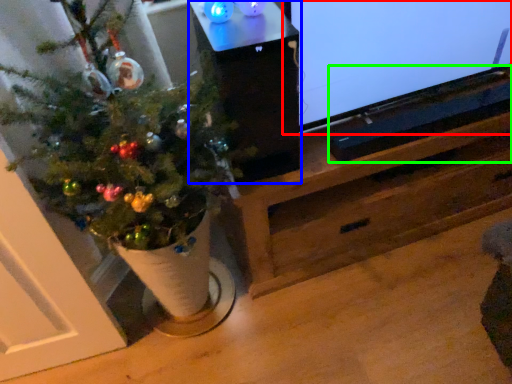
Question: Which object is positioned closest to television (highlighted by a red box)? Select from table (highlighted by a blue box) and wide (highlighted by a green box).

Choices:
 (A) table
 (B) wide

Answer: (B)